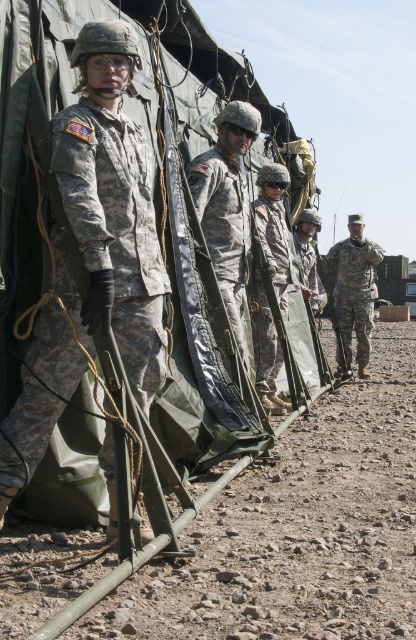
Does point (98, 248) come behind point (228, 312)?

No, it is not.

Is camouflage fabric uniform at left thinner than camouflage fabric uniform at center?

In fact, camouflage fabric uniform at left might be wider than camouflage fabric uniform at center.

Is point (88, 29) closer to camera compared to point (218, 179)?

Yes, point (88, 29) is in front of point (218, 179).

Find the location of a particular element. The image size is (416, 640). camouflage fabric uniform at left is located at coordinates (111, 209).

Can you confirm if dusty gravel ground at lower right is positioned above camouflage fabric helmet at center?

No.

The height and width of the screenshot is (640, 416). What are the coordinates of `dusty gravel ground at lower right` in the screenshot? It's located at (297, 531).

The image size is (416, 640). In order to click on dusty gravel ground at lower right in this screenshot , I will do `click(297, 531)`.

Is camouflage fabric uniform at center above camouflage fabric helmet at center?

Yes, camouflage fabric uniform at center is above camouflage fabric helmet at center.

Who is positioned more to the right, camouflage fabric uniform at center or camouflage fabric helmet at center?

Positioned to the right is camouflage fabric helmet at center.

Is point (240, 227) farther from camera compared to point (269, 188)?

No, (240, 227) is in front of (269, 188).

In order to click on camouflage fabric uniform at center in this screenshot , I will do `click(227, 208)`.